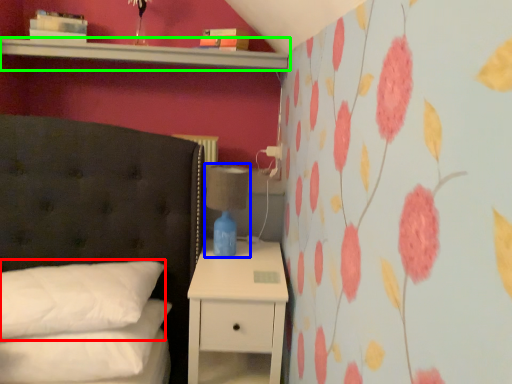
Question: Which is nearer to the pillow (highlighted by a red box)? bedside lamp (highlighted by a blue box) or shelf (highlighted by a green box).

Choices:
 (A) bedside lamp
 (B) shelf

Answer: (A)